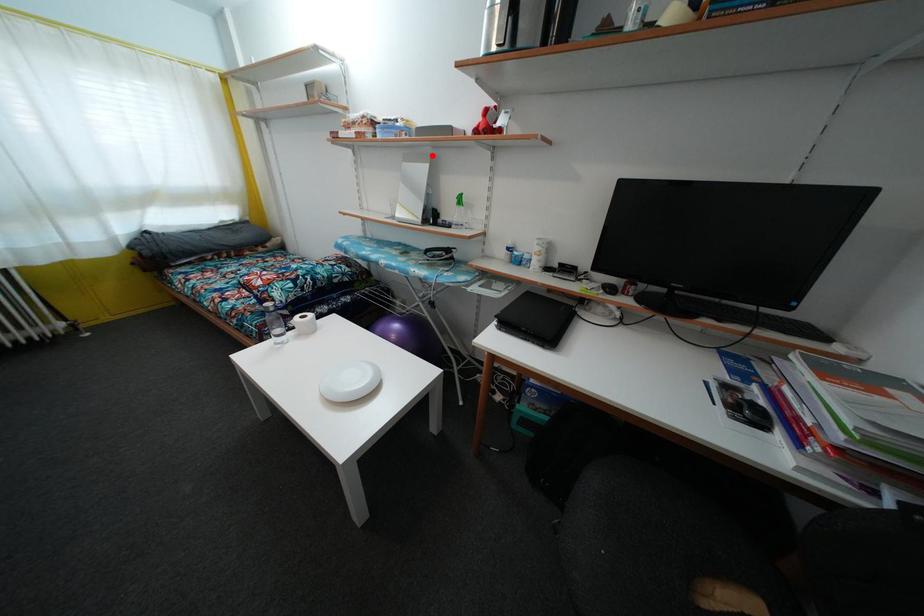
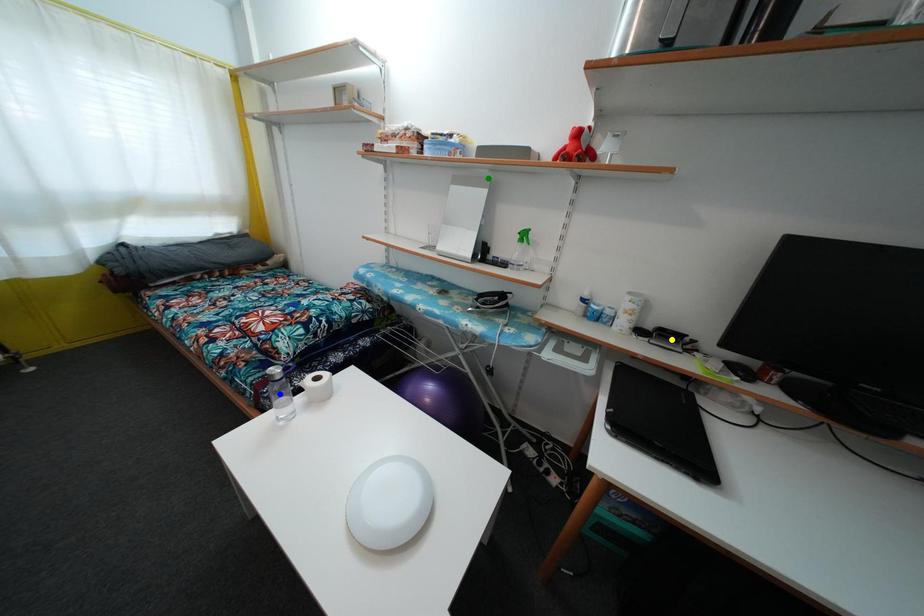
Question: I am providing you with two images of the same scene from different viewpoints. A red point is marked on the first image. You are given multiple points on the second image. In image 2, which mark is for the same physical point as the one in image 1?

Choices:
 (A) blue point
 (B) green point
 (C) yellow point

Answer: (B)